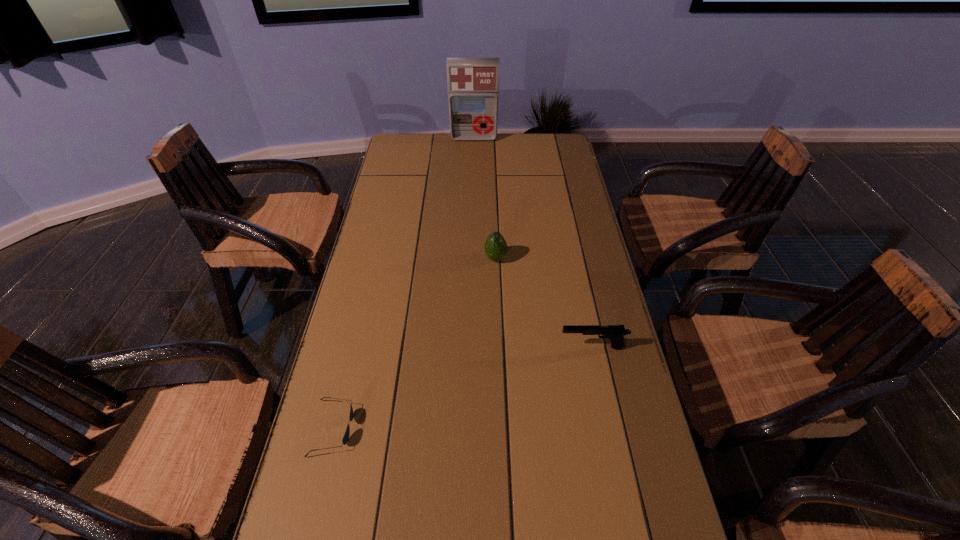
In the image, there is a desktop. At what (x,y) coordinates should I click in order to perform the action: click on vacant space at the far right corner. Please return your answer as a coordinate pair (x, y). The width and height of the screenshot is (960, 540). Looking at the image, I should click on (563, 150).

You are a GUI agent. You are given a task and a screenshot of the screen. Output one action in this format:
    pyautogui.click(x=<x>, y=<y>)
    Task: Click on the vacant point located between the second nearest object and the avocado
    This screenshot has width=960, height=540.
    Given the screenshot: What is the action you would take?
    pyautogui.click(x=544, y=303)

What are the coordinates of `free spot between the third nearest object and the leftmost object` in the screenshot? It's located at (414, 343).

Find the location of `vacant point located between the tallest object and the avocado`. vacant point located between the tallest object and the avocado is located at coordinates (485, 198).

Where is `free spot between the sunglasses and the third nearest object`? The width and height of the screenshot is (960, 540). free spot between the sunglasses and the third nearest object is located at coordinates (414, 343).

Identify the location of free space between the third nearest object and the sunglasses. (414, 343).

Identify the location of vacant region between the third nearest object and the first-aid kit. This screenshot has height=540, width=960. (485, 198).

Find the location of a particular element. Image resolution: width=960 pixels, height=540 pixels. free space that is in between the tallest object and the rightmost object is located at coordinates (533, 242).

This screenshot has height=540, width=960. I want to click on empty space that is in between the sunglasses and the avocado, so click(414, 343).

You are a GUI agent. You are given a task and a screenshot of the screen. Output one action in this format:
    pyautogui.click(x=<x>, y=<y>)
    Task: Click on the free space between the third nearest object and the leftmost object
    This screenshot has height=540, width=960.
    Given the screenshot: What is the action you would take?
    pyautogui.click(x=414, y=343)